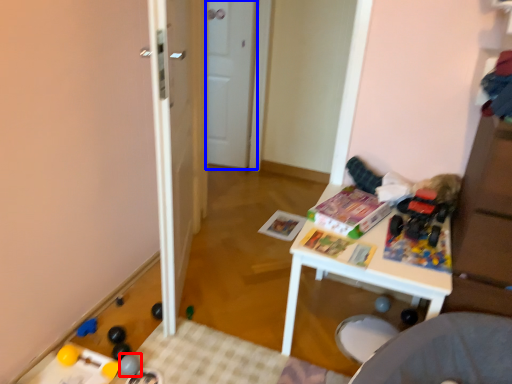
Question: Which point is further to the camera, toy (highlighted by a red box) or door (highlighted by a blue box)?

Choices:
 (A) toy
 (B) door

Answer: (B)